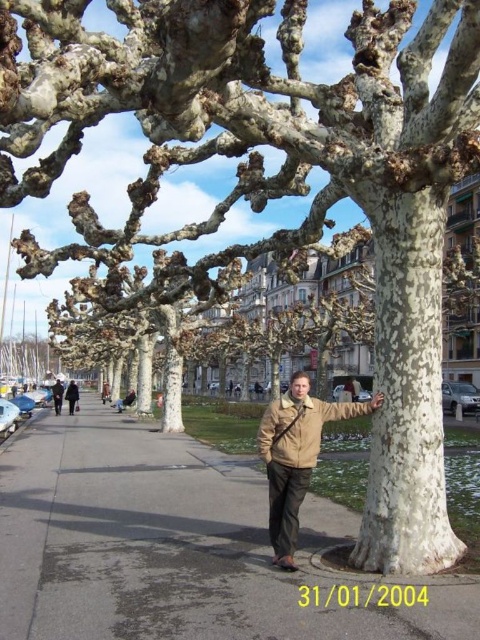
Question: Does beige leather jacket at center have a lesser width compared to khaki cotton jacket at center?

Choices:
 (A) yes
 (B) no

Answer: (A)

Question: Which point is farther from the camera taking this photo?

Choices:
 (A) (72, 401)
 (B) (101, 579)

Answer: (A)

Question: Which point is farther from the camera taking this photo?

Choices:
 (A) (271, 531)
 (B) (60, 404)

Answer: (B)

Question: Can you confirm if white textured tree trunk at center is positioned to the left of khaki cotton jacket at center?

Choices:
 (A) yes
 (B) no

Answer: (B)

Question: Which object appears farthest from the camera in this image?

Choices:
 (A) light brown leather jacket at center
 (B) white textured tree trunk at center

Answer: (A)

Question: Is white textured tree trunk at center smaller than khaki cotton jacket at center?

Choices:
 (A) no
 (B) yes

Answer: (B)